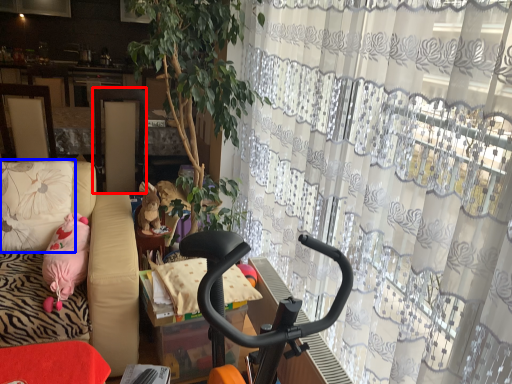
Question: Which object appears closest to the camera in this image, screen door (highlighted by a red box) or pillow (highlighted by a blue box)?

Choices:
 (A) screen door
 (B) pillow

Answer: (B)